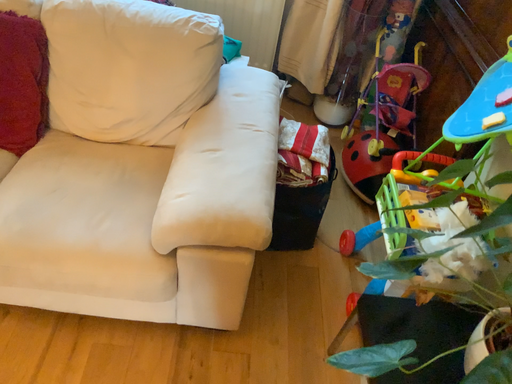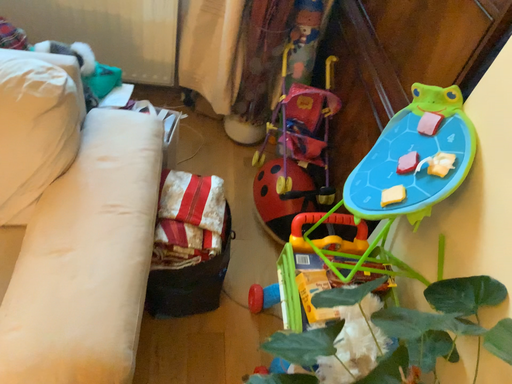
Question: How did the camera likely rotate when shooting the video?

Choices:
 (A) rotated right
 (B) rotated left

Answer: (A)